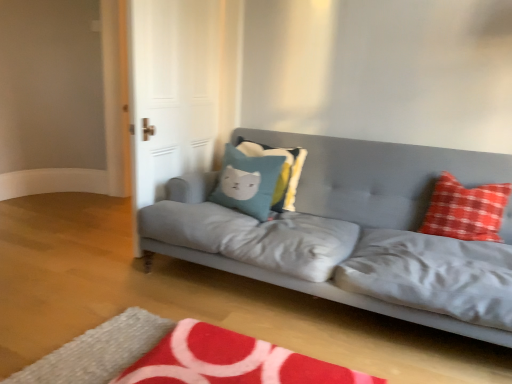
The image size is (512, 384). What are the coordinates of `free point to the left of matte gray couch at center` in the screenshot? It's located at (86, 268).